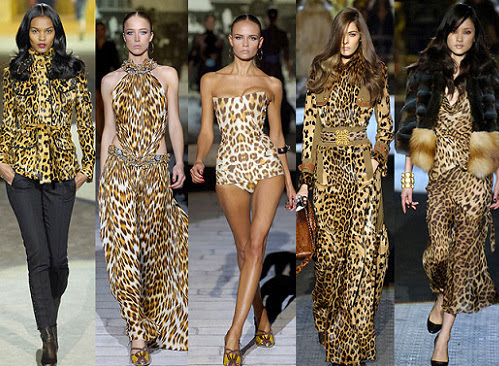
The image size is (499, 366). In order to click on floor in this screenshot , I will do `click(417, 346)`, `click(385, 341)`, `click(306, 346)`, `click(485, 330)`, `click(290, 344)`, `click(214, 286)`, `click(163, 358)`, `click(113, 320)`, `click(72, 310)`, `click(12, 308)`.